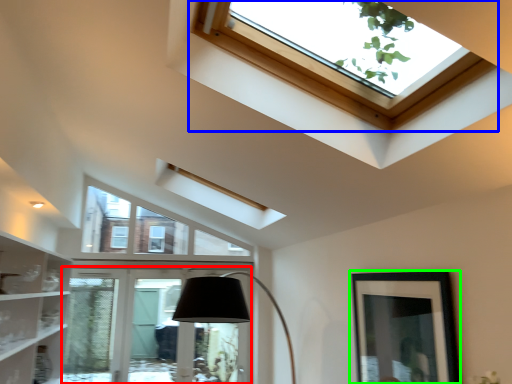
Question: Considering the real-world distances, which object is closest to glass door (highlighted by a red box)? window (highlighted by a blue box) or picture frame (highlighted by a green box).

Choices:
 (A) window
 (B) picture frame

Answer: (B)